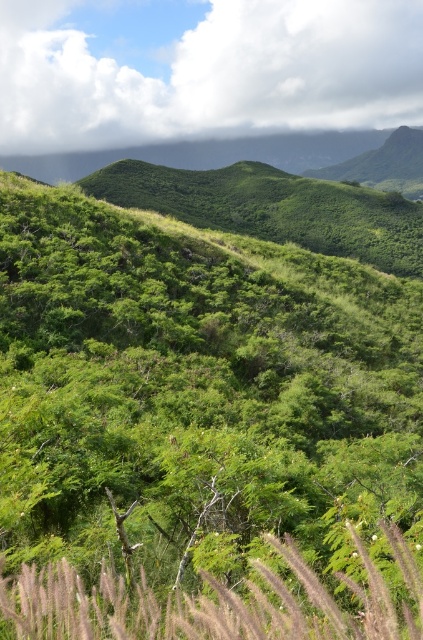
Does green leafy shrub at center appear over white fluffy cloud at upper center?

No.

In the scene shown: Which of these two, green leafy shrub at center or white fluffy cloud at upper center, stands shorter?

green leafy shrub at center is shorter.

The height and width of the screenshot is (640, 423). In order to click on green leafy shrub at center in this screenshot , I will do `click(198, 392)`.

The width and height of the screenshot is (423, 640). Find the location of `green leafy shrub at center`. green leafy shrub at center is located at coordinates (198, 392).

Does green leafy shrub at center have a lesser width compared to silvery grass at center?

Incorrect, green leafy shrub at center's width is not less than silvery grass at center's.

Is green leafy shrub at center closer to camera compared to silvery grass at center?

No, green leafy shrub at center is behind silvery grass at center.

Is point (422, 387) positioned after point (364, 552)?

Yes, it is behind point (364, 552).

Where is `green leafy shrub at center`? This screenshot has height=640, width=423. green leafy shrub at center is located at coordinates (198, 392).

Between point (348, 97) and point (230, 609), which one is positioned in front?

Point (230, 609)

Does point (32, 81) come behind point (293, 556)?

Yes.

You are a GUI agent. You are given a task and a screenshot of the screen. Output one action in this format:
    pyautogui.click(x=<x>, y=<y>)
    Task: Click on the white fluffy cloud at upper center
    
    Given the screenshot: What is the action you would take?
    pyautogui.click(x=202, y=68)